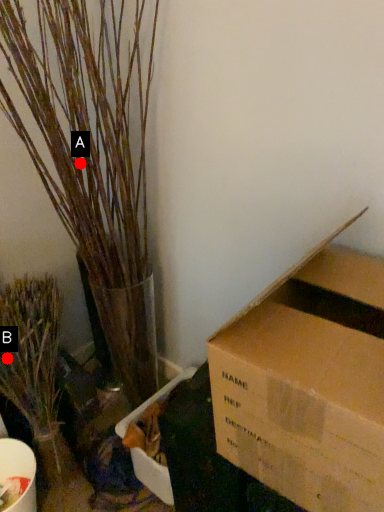
Question: Two points are circled on the image, labeled by A and B beside each circle. Which point is farther to the camera?

Choices:
 (A) A is further
 (B) B is further

Answer: (A)